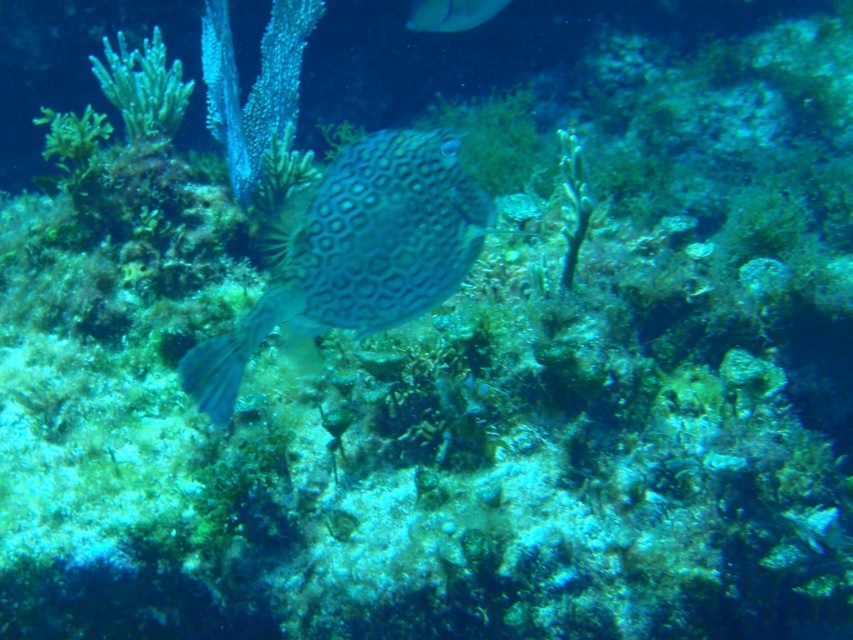
Question: Is patterned skin fish at center below smooth yellow fish at upper center?

Choices:
 (A) yes
 (B) no

Answer: (A)

Question: Does green matte algae at upper left have a greater width compared to smooth yellow fish at upper center?

Choices:
 (A) no
 (B) yes

Answer: (A)

Question: Which is nearer to the patterned skin fish at center?

Choices:
 (A) smooth yellow fish at upper center
 (B) green matte algae at upper left

Answer: (B)

Question: Which object appears closest to the camera in this image?

Choices:
 (A) smooth yellow fish at upper center
 (B) patterned skin fish at center
 (C) green matte algae at upper left

Answer: (B)

Question: Does patterned skin fish at center come behind smooth yellow fish at upper center?

Choices:
 (A) yes
 (B) no

Answer: (B)

Question: Which object appears closest to the camera in this image?

Choices:
 (A) patterned skin fish at center
 (B) green matte algae at upper left

Answer: (A)